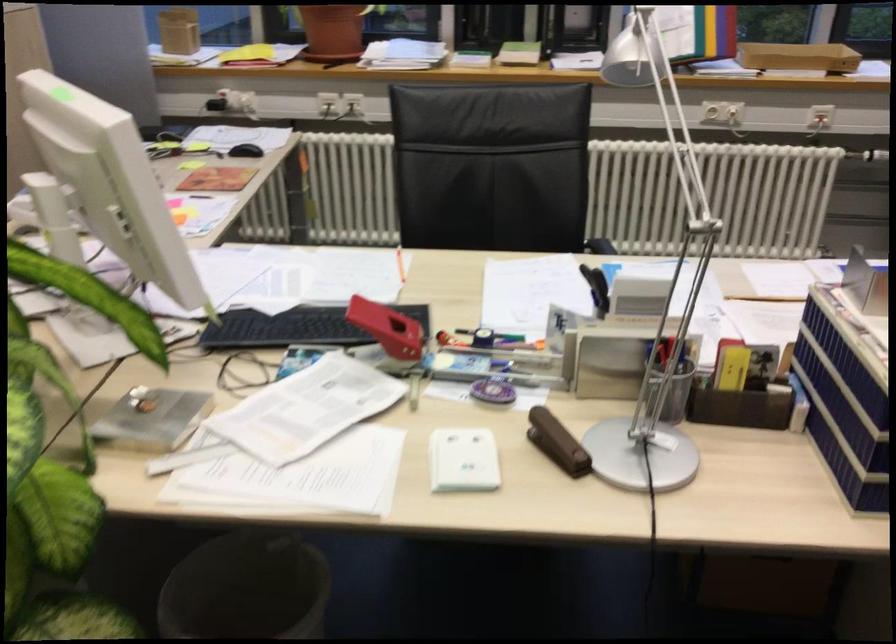
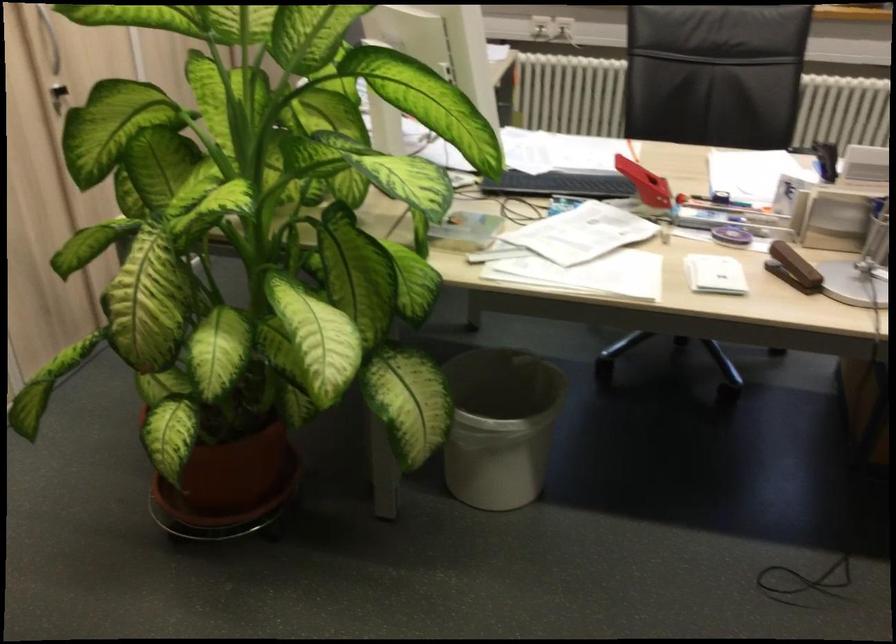
Where in the second image is the point corresponding to point 561,440 from the first image?

(793, 268)